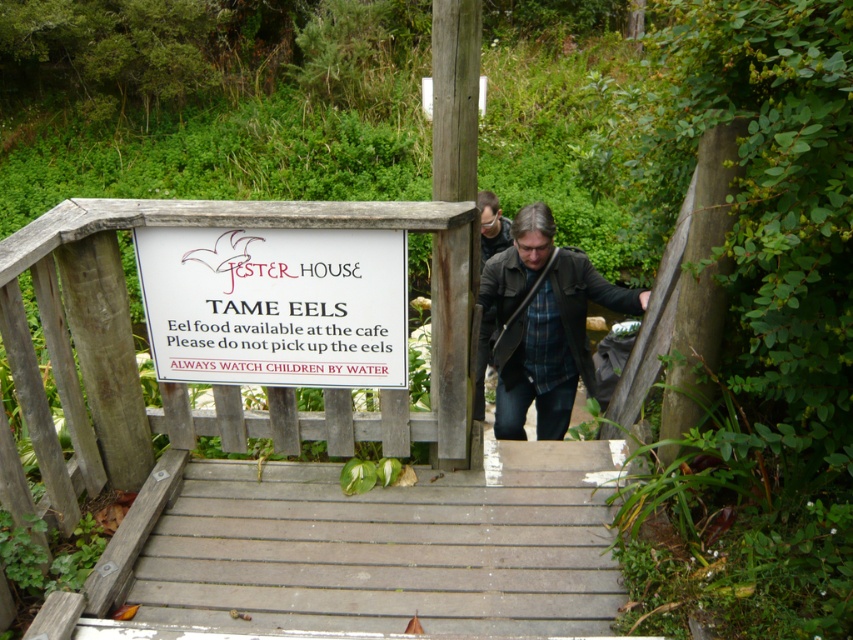
Is point (221, 435) closer to camera compared to point (334, 272)?

No, it is not.

From the picture: Measure the distance between wooden rail at upper center and white paper sign at upper center.

They are 7.61 inches apart.

Where is `wooden rail at upper center`? wooden rail at upper center is located at coordinates tap(213, 385).

Does wooden rail at upper center have a greater width compared to dark brown leather jacket at center?

Yes.

Is point (102, 429) farther from camera compared to point (566, 305)?

No, (102, 429) is closer to viewer.

Does point (335, 404) come behind point (535, 269)?

No, (335, 404) is in front of (535, 269).

At what (x,y) coordinates should I click in order to perform the action: click on wooden rail at upper center. Please return your answer as a coordinate pair (x, y). The image size is (853, 640). Looking at the image, I should click on (213, 385).

Is point (350, 332) closer to viewer compared to point (547, 344)?

Yes.

The width and height of the screenshot is (853, 640). What do you see at coordinates (276, 305) in the screenshot?
I see `white paper sign at upper center` at bounding box center [276, 305].

At what (x,y) coordinates should I click in order to perform the action: click on white paper sign at upper center. Please return your answer as a coordinate pair (x, y). Image resolution: width=853 pixels, height=640 pixels. Looking at the image, I should click on [276, 305].